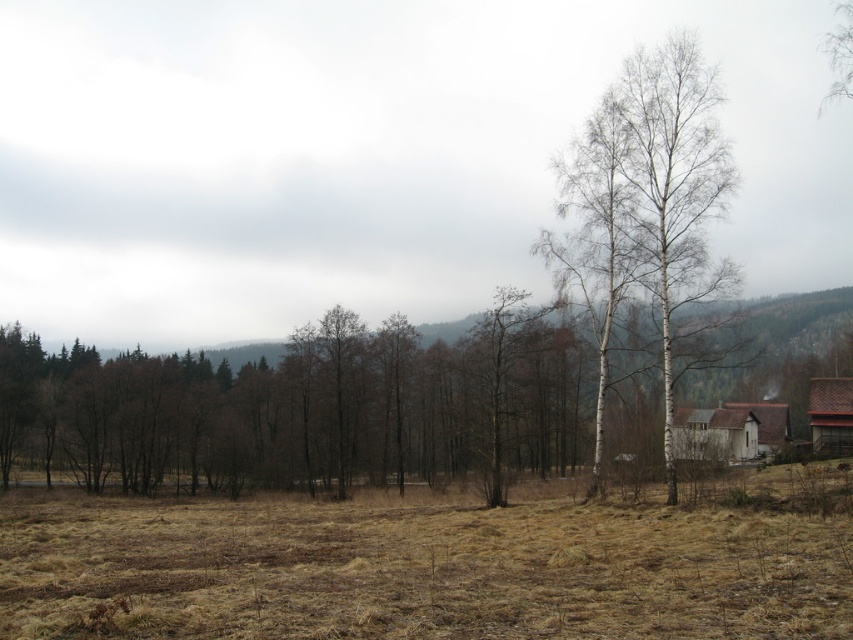
Does brown grass at center have a smaller size compared to white wooden house at lower right?

Result: Incorrect, brown grass at center is not smaller in size than white wooden house at lower right.

Can you confirm if brown grass at center is positioned to the right of white wooden house at lower right?

No, brown grass at center is not to the right of white wooden house at lower right.

The height and width of the screenshot is (640, 853). Find the location of `brown grass at center`. brown grass at center is located at coordinates (428, 566).

Where is `brown grass at center`? The width and height of the screenshot is (853, 640). brown grass at center is located at coordinates (428, 566).

Is point (621, 97) positioned after point (816, 403)?

No, (621, 97) is closer to viewer.

Does white bark tree at right appear on the right side of brown wooden barn at lower right?

No, white bark tree at right is not to the right of brown wooden barn at lower right.

Between point (608, 342) and point (833, 444), which one is positioned behind?

Positioned behind is point (833, 444).

The height and width of the screenshot is (640, 853). I want to click on white bark tree at right, so click(646, 205).

Is white bark tree at right wider than white wooden house at lower right?

Incorrect, white bark tree at right's width does not surpass white wooden house at lower right's.

Which is in front, point (608, 148) or point (764, 404)?

Positioned in front is point (608, 148).

Locate an element on the screen. Image resolution: width=853 pixels, height=640 pixels. white bark tree at right is located at coordinates (646, 205).